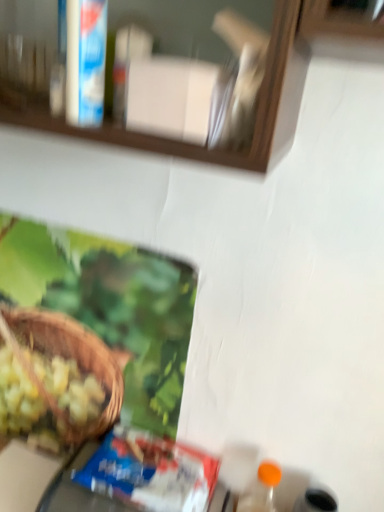
In order to face wooden shelf at upper center, should I rotate leftwards or rightwards?

You should rotate left by 13.353 degrees.

What do you see at coordinates (257, 116) in the screenshot? I see `wooden shelf at upper center` at bounding box center [257, 116].

Measure the distance between wooden shelf at upper center and camera.

wooden shelf at upper center and camera are 13.16 inches apart from each other.

Find the location of a particular element. The height and width of the screenshot is (512, 384). wooden shelf at upper center is located at coordinates (257, 116).

You are a GUI agent. You are given a task and a screenshot of the screen. Output one action in this format:
    pyautogui.click(x=<x>, y=<y>)
    Task: Click on the wooden shelf at upper center
    
    Given the screenshot: What is the action you would take?
    pyautogui.click(x=257, y=116)